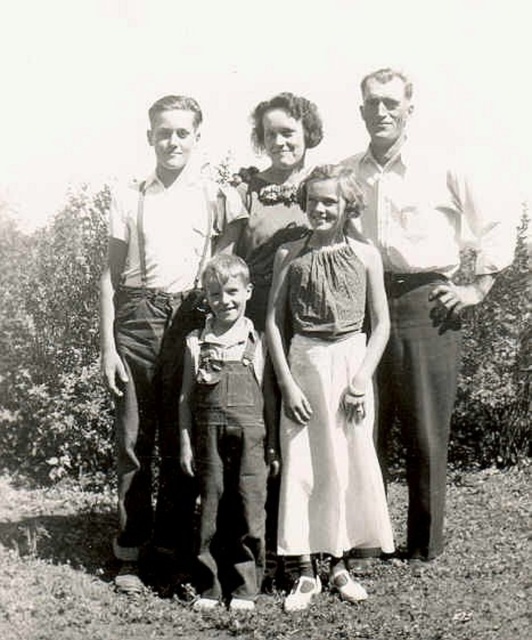
Question: Considering the relative positions of matte white shirt at upper left and denim overalls at center in the image provided, where is matte white shirt at upper left located with respect to denim overalls at center?

Choices:
 (A) left
 (B) right

Answer: (B)

Question: Among these objects, which one is nearest to the camera?

Choices:
 (A) matte floral dress at center
 (B) denim overalls at center

Answer: (B)

Question: Is matte white shirt at upper left above smooth white shirt at center?

Choices:
 (A) no
 (B) yes

Answer: (B)

Question: Considering the relative positions of matte white shirt at upper left and smooth white shirt at center in the image provided, where is matte white shirt at upper left located with respect to smooth white shirt at center?

Choices:
 (A) right
 (B) left

Answer: (A)

Question: Which of these objects is positioned closest to the white cotton shirt at left?

Choices:
 (A) matte floral dress at center
 (B) denim overalls at center
 (C) smooth white shirt at center
 (D) textured white dress at center

Answer: (B)

Question: Which point is closer to the camera?

Choices:
 (A) (204, 237)
 (B) (276, 456)
 (C) (204, 544)
 (D) (338, 573)

Answer: (D)